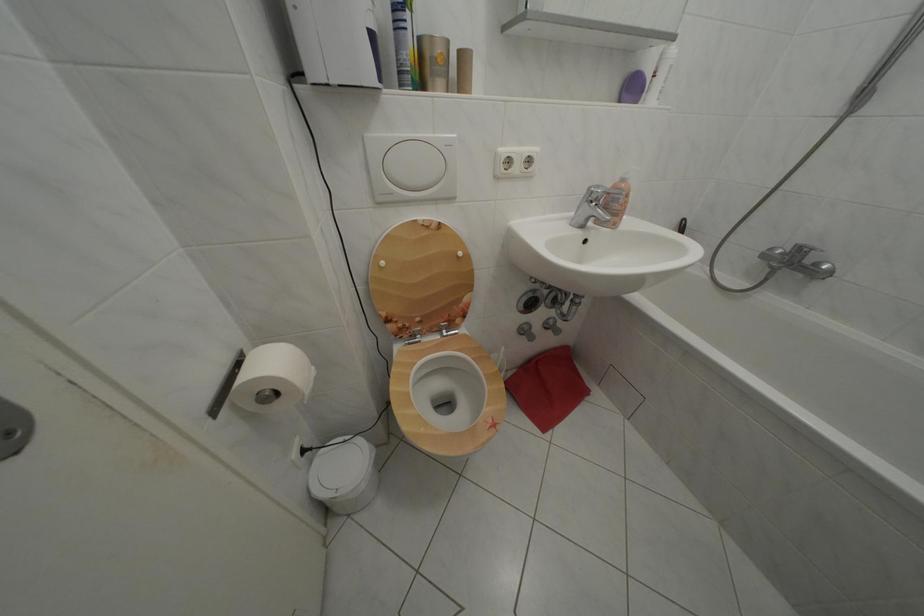
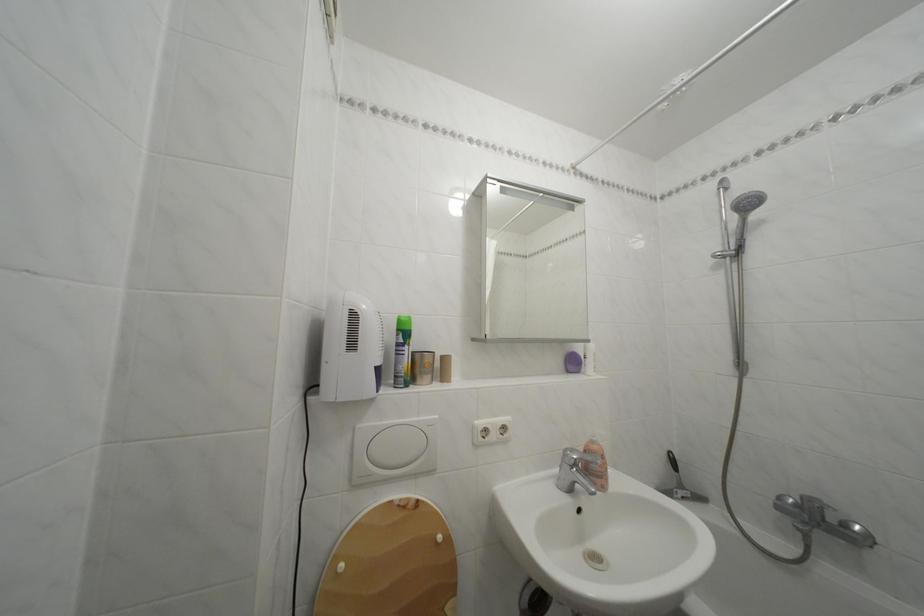
Question: The first image is from the beginning of the video and the second image is from the end. How did the camera likely rotate when shooting the video?

Choices:
 (A) Left
 (B) Right
 (C) Up
 (D) Down

Answer: (C)